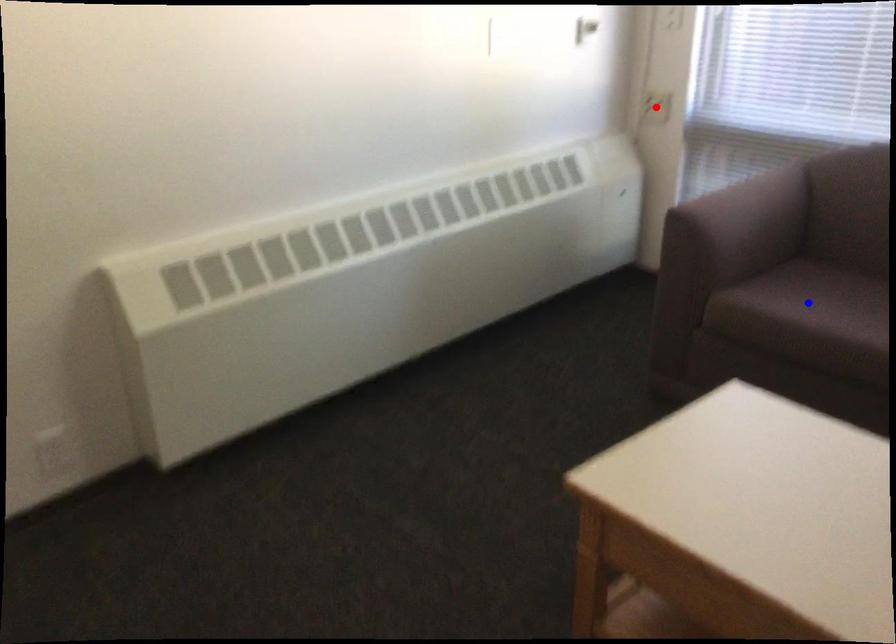
Question: In the image, two points are highlighted. Which point is nearer to the camera? Reply with the corresponding letter.

Choices:
 (A) blue point
 (B) red point

Answer: (A)